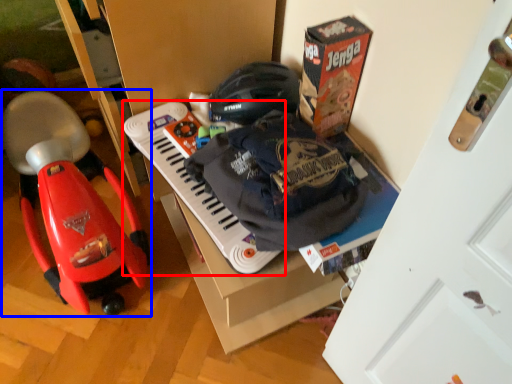
Question: Which object is further to the camera taking this photo, musical keyboard (highlighted by a red box) or baby carriage (highlighted by a blue box)?

Choices:
 (A) musical keyboard
 (B) baby carriage

Answer: (A)